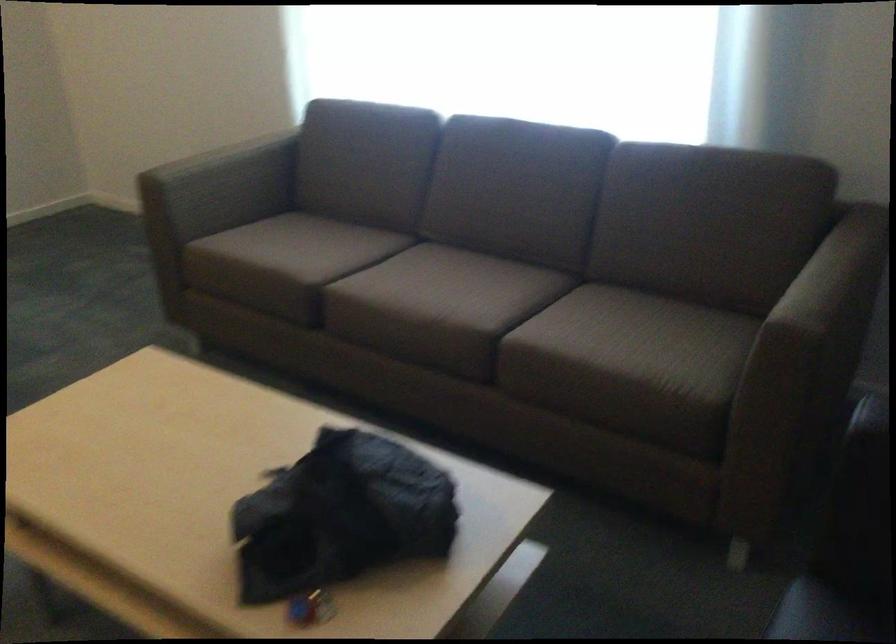
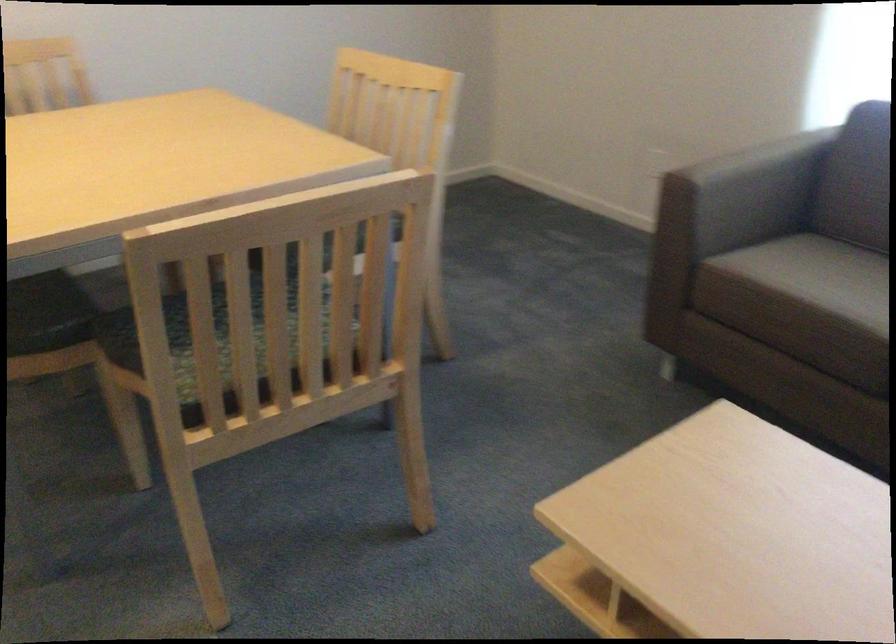
Question: Which direction would the cameraman need to move to produce the second image? Reply with the corresponding letter.

Choices:
 (A) Left
 (B) Right
 (C) Forward
 (D) Backward

Answer: (A)